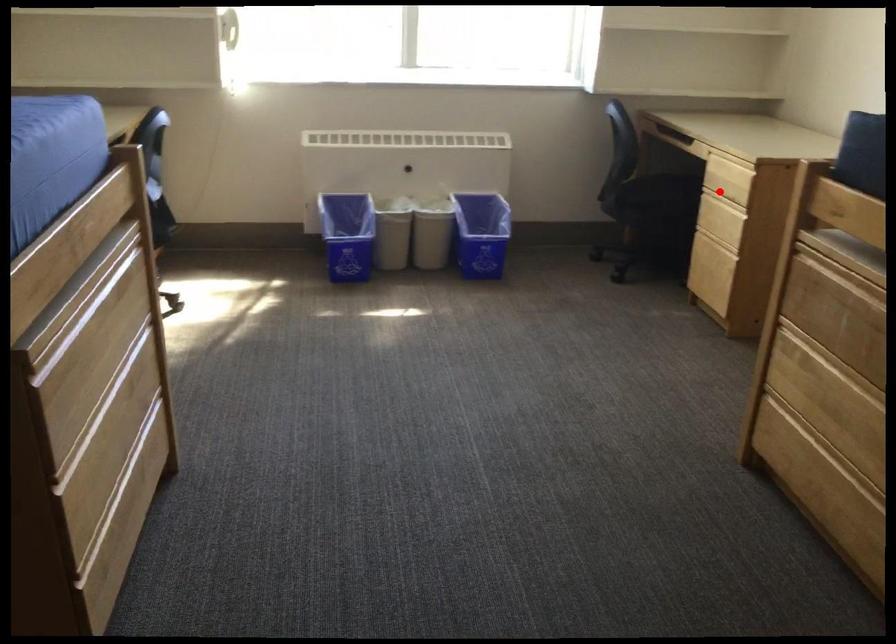
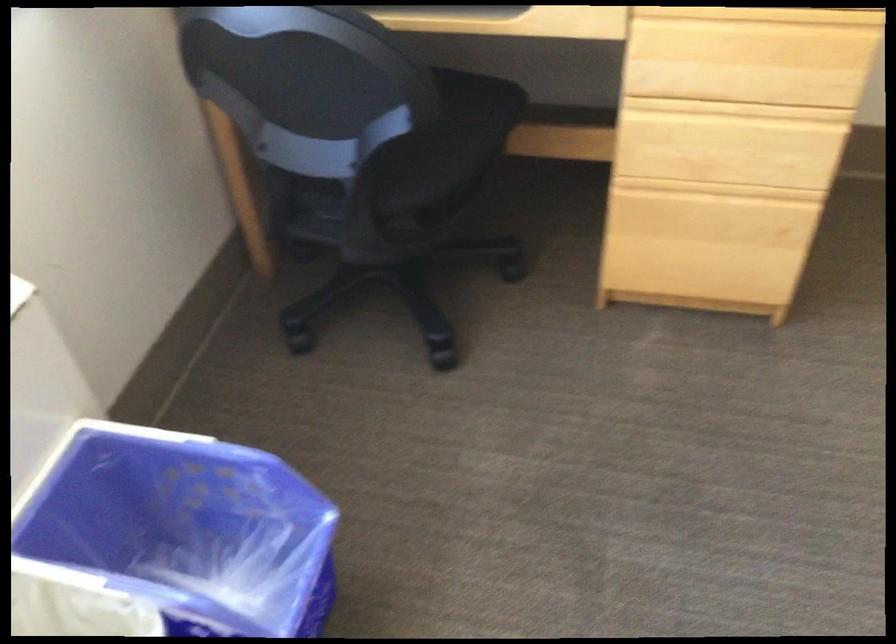
The point at the highlighted location is marked in the first image. Where is the corresponding point in the second image?

(736, 109)